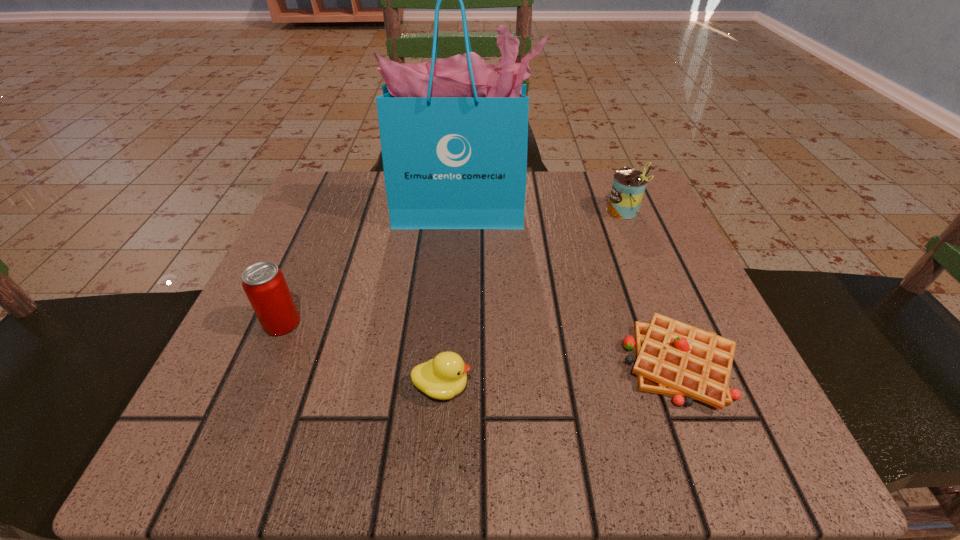
Where is `free space in the image that satisfies the following two spatial constraints: 1. on the back side of the right can; 2. on the left side of the left can`? free space in the image that satisfies the following two spatial constraints: 1. on the back side of the right can; 2. on the left side of the left can is located at coordinates (330, 211).